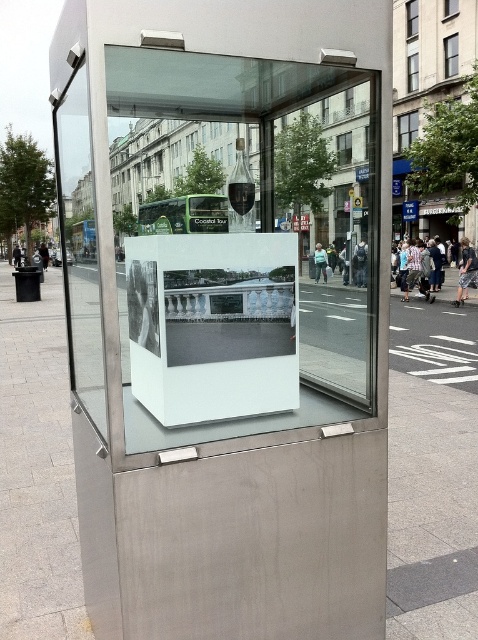
Question: Which of the following is the closest to the observer?

Choices:
 (A) (465, 344)
 (B) (61, 182)
 (C) (230, 298)

Answer: (C)

Question: Estimate the real-world distances between objects in this image. Which object is closer to the brushed metal pavement at center?

Choices:
 (A) white glossy photo frame at center
 (B) transparent glass door at left

Answer: (B)

Question: Does brushed metal pavement at center have a lesser width compared to transparent glass door at left?

Choices:
 (A) no
 (B) yes

Answer: (A)

Question: Which object appears farthest from the camera in this image?

Choices:
 (A) brushed metal pavement at center
 (B) transparent glass door at left
 (C) white glossy photo frame at center

Answer: (A)

Question: Can you confirm if brushed metal pavement at center is positioned above transparent glass door at left?

Choices:
 (A) no
 (B) yes

Answer: (A)

Question: Does white glossy photo frame at center appear on the right side of transparent glass door at left?

Choices:
 (A) no
 (B) yes

Answer: (B)